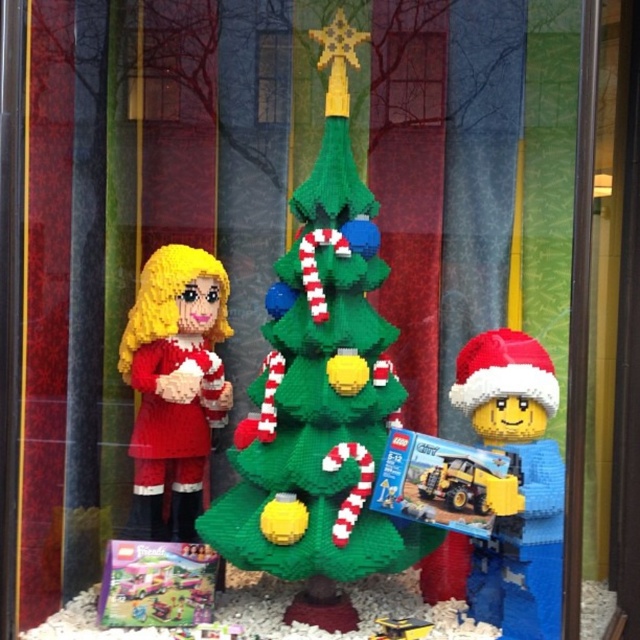
You are a customer looking at the LEGO display through the store window. You see the yellow matte lego man at right and the transparent glass at center. Which object appears bigger to you?

The yellow matte lego man at right appears bigger than the transparent glass at center because it is larger in size.

You are a child looking at the festive LEGO display through the transparent glass window at center. You see the translucent plastic toy at center. Is the toy located to the left or right side of the window?

The translucent plastic toy at center is to the left of the transparent glass window at center.